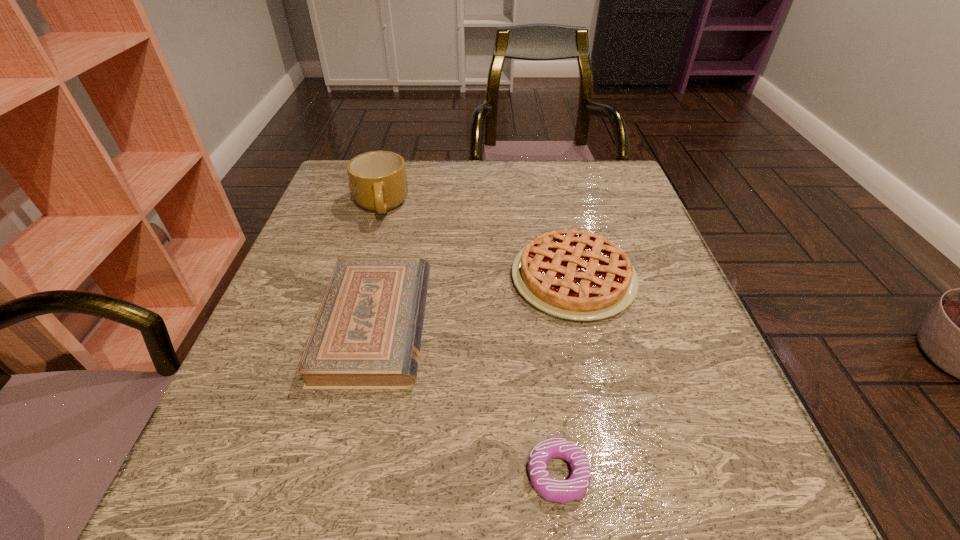
Identify which object is the closest to the shortest object. Please provide its 2D coordinates. Your answer should be formatted as a tuple, i.e. [(x, y)], where the tuple contains the x and y coordinates of a point satisfying the conditions above.

[(367, 334)]

Identify the location of object identified as the third closest to the shortest object. This screenshot has height=540, width=960. (377, 179).

What are the coordinates of `free point that satisfies the following two spatial constraints: 1. on the spine side of the Bible; 2. on the right side of the doughnut` in the screenshot? It's located at (341, 474).

Find the location of a particular element. The width and height of the screenshot is (960, 540). free space that satisfies the following two spatial constraints: 1. on the back side of the doughnut; 2. on the spine side of the Bible is located at coordinates (539, 325).

At what (x,y) coordinates should I click in order to perform the action: click on vacant region that satisfies the following two spatial constraints: 1. on the side with the handle of the shortest object; 2. on the right side of the farthest object. Please return your answer as a coordinate pair (x, y). The height and width of the screenshot is (540, 960). Looking at the image, I should click on (303, 474).

The image size is (960, 540). I want to click on vacant space that satisfies the following two spatial constraints: 1. on the front side of the pie; 2. on the spine side of the Bible, so point(584,325).

You are a GUI agent. You are given a task and a screenshot of the screen. Output one action in this format:
    pyautogui.click(x=<x>, y=<y>)
    Task: Click on the vacant space that satisfies the following two spatial constraints: 1. on the side with the handle of the nearest object; 2. on the left side of the mug
    This screenshot has height=540, width=960.
    Given the screenshot: What is the action you would take?
    pyautogui.click(x=303, y=474)

What are the coordinates of `free space that satisfies the following two spatial constraints: 1. on the side with the handle of the doughnut; 2. on the left side of the farthest object` in the screenshot? It's located at (303, 474).

Where is `vacant space that satisfies the following two spatial constraints: 1. on the side with the handle of the farthest object; 2. on the right side of the shortest object`? vacant space that satisfies the following two spatial constraints: 1. on the side with the handle of the farthest object; 2. on the right side of the shortest object is located at coordinates (303, 474).

Image resolution: width=960 pixels, height=540 pixels. Find the location of `free space that satisfies the following two spatial constraints: 1. on the front side of the pie; 2. on the spine side of the Bible`. free space that satisfies the following two spatial constraints: 1. on the front side of the pie; 2. on the spine side of the Bible is located at coordinates (584, 325).